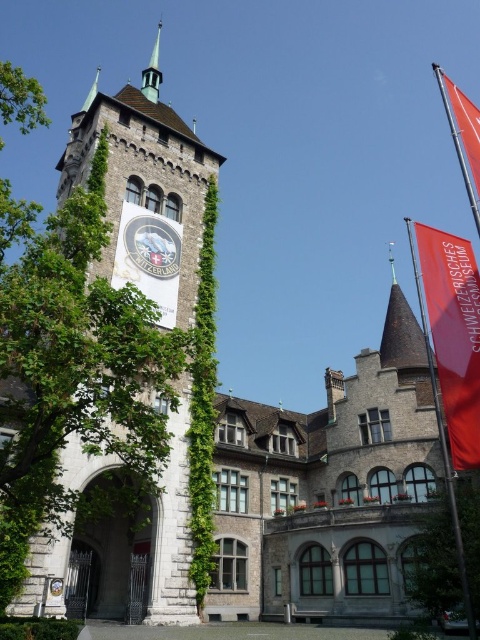
Which of these two, stone clock tower at left or metallic flag pole at upper right, stands shorter?

With less height is metallic flag pole at upper right.

Measure the distance between stone clock tower at left and camera.

The distance of stone clock tower at left from camera is 108.24 feet.

You are a GUI agent. You are given a task and a screenshot of the screen. Output one action in this format:
    pyautogui.click(x=<x>, y=<y>)
    Task: Click on the stone clock tower at left
    Image resolution: width=480 pixels, height=640 pixels.
    Given the screenshot: What is the action you would take?
    pyautogui.click(x=164, y=304)

Who is positioned more to the left, metallic flag pole at upper right or shiny copper spire at upper center?

From the viewer's perspective, shiny copper spire at upper center appears more on the left side.

Between metallic flag pole at upper right and shiny copper spire at upper center, which one is positioned lower?

Positioned lower is metallic flag pole at upper right.

Is point (475, 209) closer to camera compared to point (156, 45)?

Yes, it is in front of point (156, 45).

Image resolution: width=480 pixels, height=640 pixels. I want to click on metallic flag pole at upper right, so click(x=456, y=145).

Does red fabric banner at upper right have a lesser width compared to metallic flag pole at upper right?

Indeed, red fabric banner at upper right has a lesser width compared to metallic flag pole at upper right.

Does point (457, 237) come closer to viewer compared to point (435, 65)?

Yes, point (457, 237) is in front of point (435, 65).

Locate an element on the screen. red fabric banner at upper right is located at coordinates (454, 333).